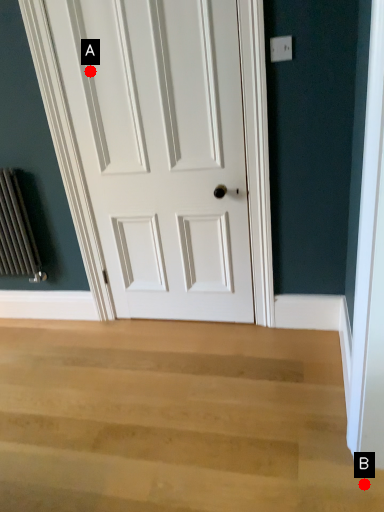
Question: Two points are circled on the image, labeled by A and B beside each circle. Which point is further to the camera?

Choices:
 (A) A is further
 (B) B is further

Answer: (A)